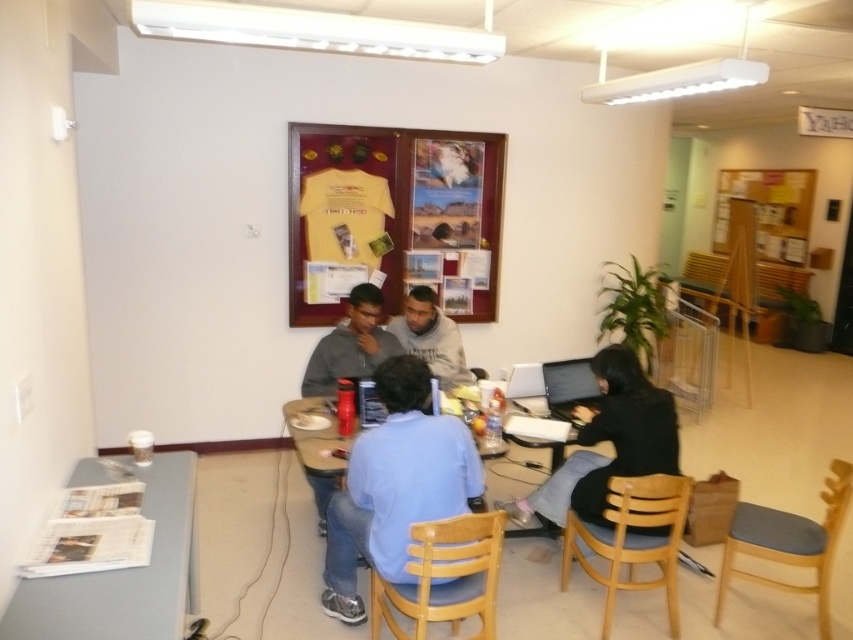
You are a delivery person who needs to place a small package on the white glossy table at lower left. You are currently standing next to the blue cotton shirt at center. Can you reach the table without moving your feet?

The blue cotton shirt at center and white glossy table at lower left are 28.62 inches apart. Since the distance is less than the typical human arm reach of around 24 to 30 inches, you can likely reach the white glossy table at lower left without moving your feet.

You are organizing a community event and need to hang a large poster. You have the yellow fabric bulletin board at upper center and the gray fleece jacket at center in the room. Which object can you use to display the poster?

The yellow fabric bulletin board at upper center can be used to display the poster because it has a larger size compared to the gray fleece jacket at center.